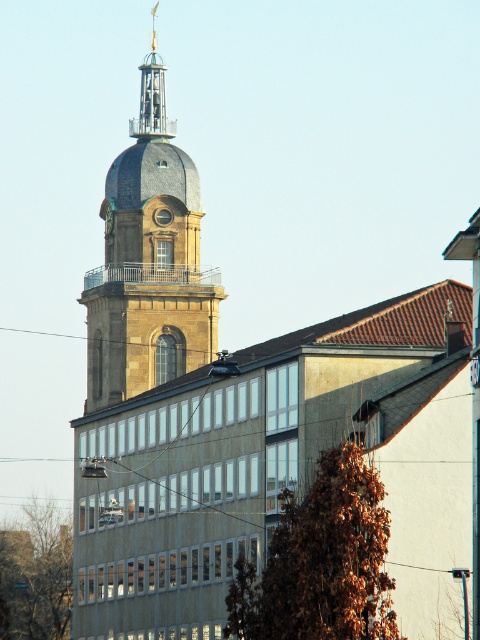
You are an architect reviewing the blueprint of the building. You notice two towers in the design, the golden stone tower at upper center and the polished brass clock tower at upper center. Which one is located below the other?

The golden stone tower at upper center is positioned under the polished brass clock tower at upper center, so the golden stone tower is below the polished brass clock tower.

You are standing at the entrance of the modern building and want to take a photo of the golden stone tower at upper center. Based on the coordinates provided, in which general direction should you point your camera to capture the tower?

The golden stone tower at upper center is located at coordinates point [148,260], which means it is positioned slightly to the left and upper part of the image. Therefore, you should point your camera to the left and upwards to capture the tower.

You are an architect analyzing the layout of the buildings in the image. Which of the two towers, the golden stone tower at upper center or the polished brass clock tower at upper center, is positioned farther to the left side of the image?

The golden stone tower at upper center is positioned farther to the left side of the image compared to the polished brass clock tower at upper center.